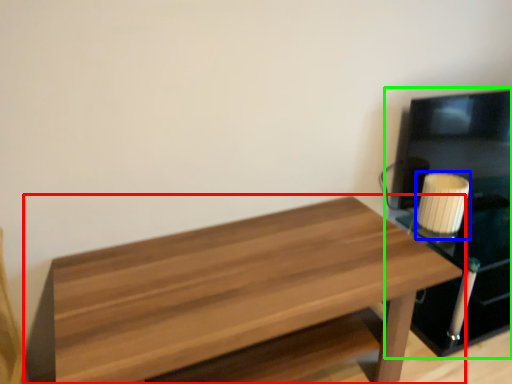
Question: Estimate the real-world distances between objects in this image. Which object is farther from table (highlighted by a red box), candle holder (highlighted by a blue box) or entertainment center (highlighted by a green box)?

Choices:
 (A) candle holder
 (B) entertainment center

Answer: (B)